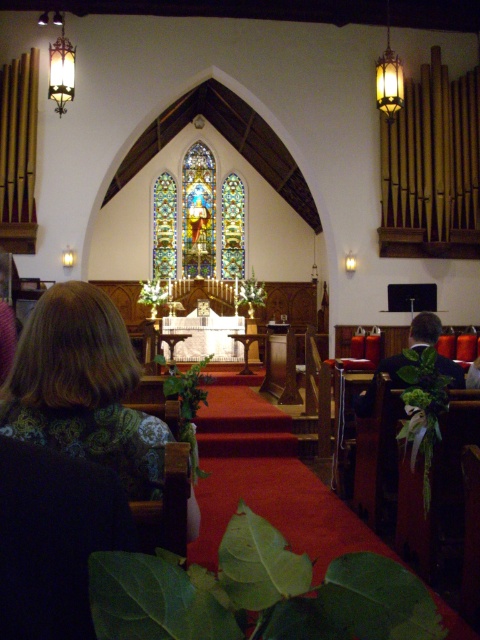
Question: Among these objects, which one is farthest from the camera?

Choices:
 (A) brown textured hair at lower left
 (B) stained glass at center

Answer: (B)

Question: Is brown textured hair at lower left above stained glass at center?

Choices:
 (A) yes
 (B) no

Answer: (B)

Question: Is brown textured hair at lower left below stained glass at center?

Choices:
 (A) no
 (B) yes

Answer: (B)

Question: Where is brown textured hair at lower left located in relation to stained glass at center in the image?

Choices:
 (A) right
 (B) left

Answer: (A)

Question: Which object appears farthest from the camera in this image?

Choices:
 (A) brown textured hair at lower left
 (B) stained glass at center

Answer: (B)